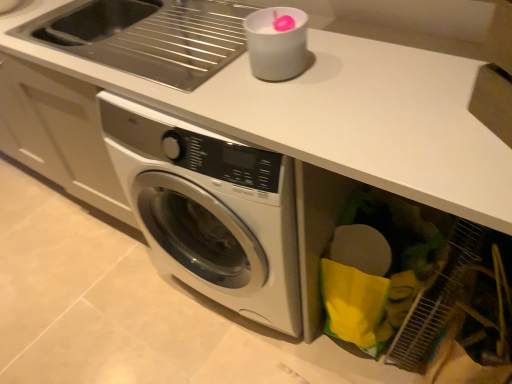
You are a GUI agent. You are given a task and a screenshot of the screen. Output one action in this format:
    pyautogui.click(x=<x>, y=<y>)
    Task: Click on the unoccupied region to the right of white plastic cup at upper center
    This screenshot has height=384, width=512.
    Given the screenshot: What is the action you would take?
    pyautogui.click(x=332, y=55)